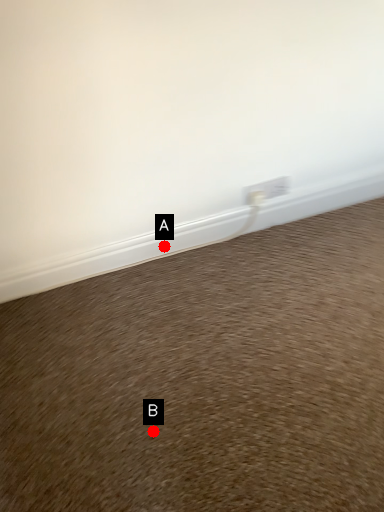
Question: Two points are circled on the image, labeled by A and B beside each circle. Which point is closer to the camera taking this photo?

Choices:
 (A) A is closer
 (B) B is closer

Answer: (B)